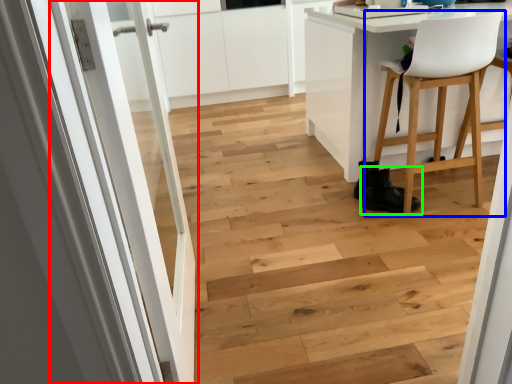
Question: Which object is the farthest from door (highlighted by a red box)? Choose among these: chair (highlighted by a blue box) or footwear (highlighted by a green box).

Choices:
 (A) chair
 (B) footwear

Answer: (A)